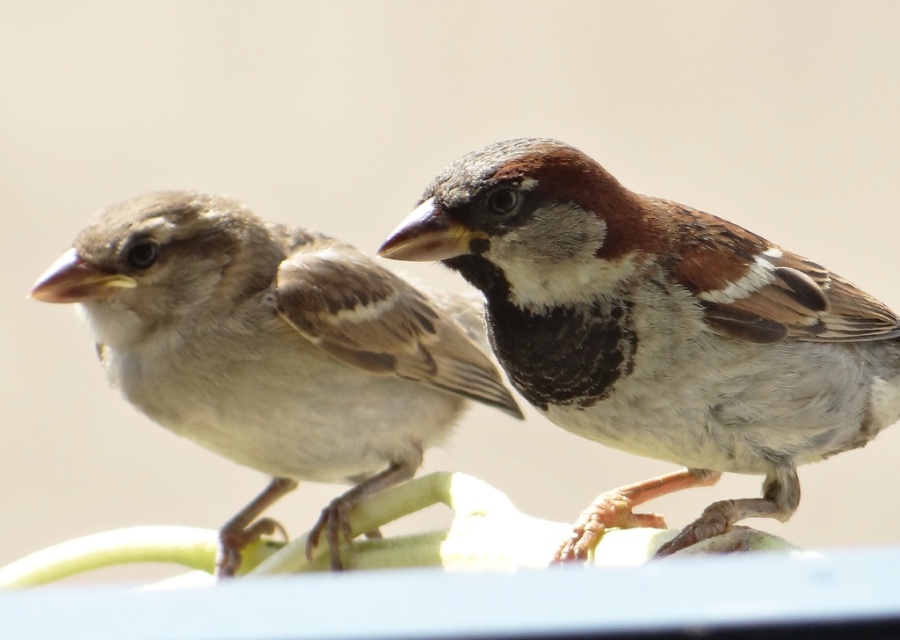
Which is more to the left, brown speckled feathers at center or brown feathered sparrow at left?

brown feathered sparrow at left

Is brown speckled feathers at center closer to camera compared to brown feathered sparrow at left?

Yes, brown speckled feathers at center is in front of brown feathered sparrow at left.

The width and height of the screenshot is (900, 640). What do you see at coordinates (657, 330) in the screenshot?
I see `brown speckled feathers at center` at bounding box center [657, 330].

Find the location of a particular element. Image resolution: width=900 pixels, height=640 pixels. brown speckled feathers at center is located at coordinates (657, 330).